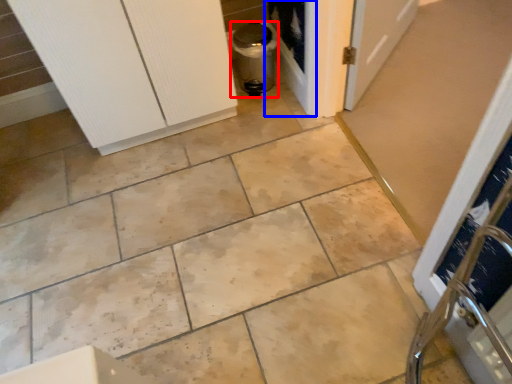
Question: Which of the following is the farthest to the observer, appliance (highlighted by a red box) or screen door (highlighted by a blue box)?

Choices:
 (A) appliance
 (B) screen door

Answer: (B)